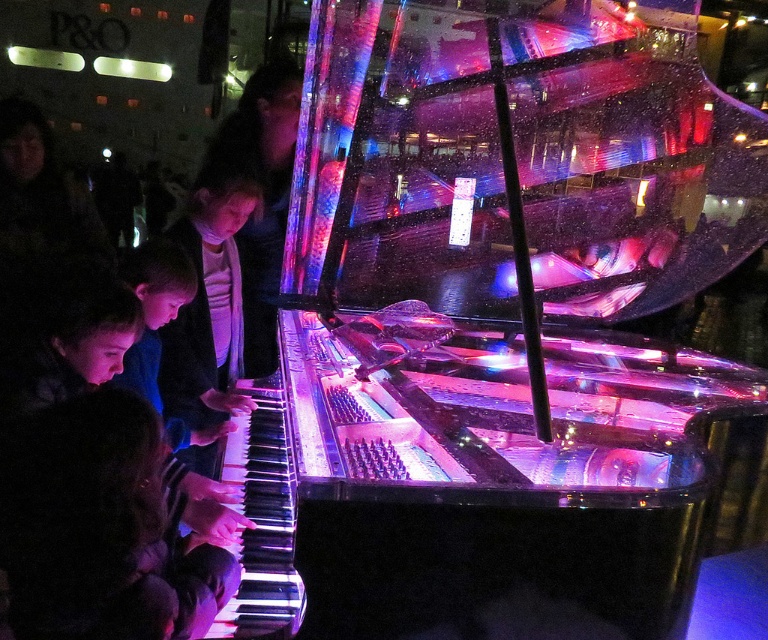
Between point (58, 531) and point (177, 246), which one is positioned behind?

The point (177, 246) is more distant.

Can you confirm if dark hair at lower left is bigger than matte black piano keys at left?

No, dark hair at lower left is not bigger than matte black piano keys at left.

Who is more forward, (x=47, y=600) or (x=136, y=358)?

Point (x=47, y=600)

Locate an element on the screen. This screenshot has width=768, height=640. dark hair at lower left is located at coordinates [x=101, y=529].

Which of these two, transparent glass piano at left or dark hair at lower left, stands shorter?

Standing shorter between the two is dark hair at lower left.

Is point (353, 410) behind point (141, 522)?

Yes, it is behind point (141, 522).

Identify the location of transparent glass piano at left. (492, 481).

Does transparent glass piano at left appear on the left side of matte black piano keys at left?

Incorrect, transparent glass piano at left is not on the left side of matte black piano keys at left.

Which of these two, transparent glass piano at left or matte black piano keys at left, stands taller?

transparent glass piano at left is taller.

Who is more forward, (419, 371) or (144, 291)?

Point (144, 291) is in front.

Locate an element on the screen. This screenshot has height=640, width=768. transparent glass piano at left is located at coordinates (492, 481).